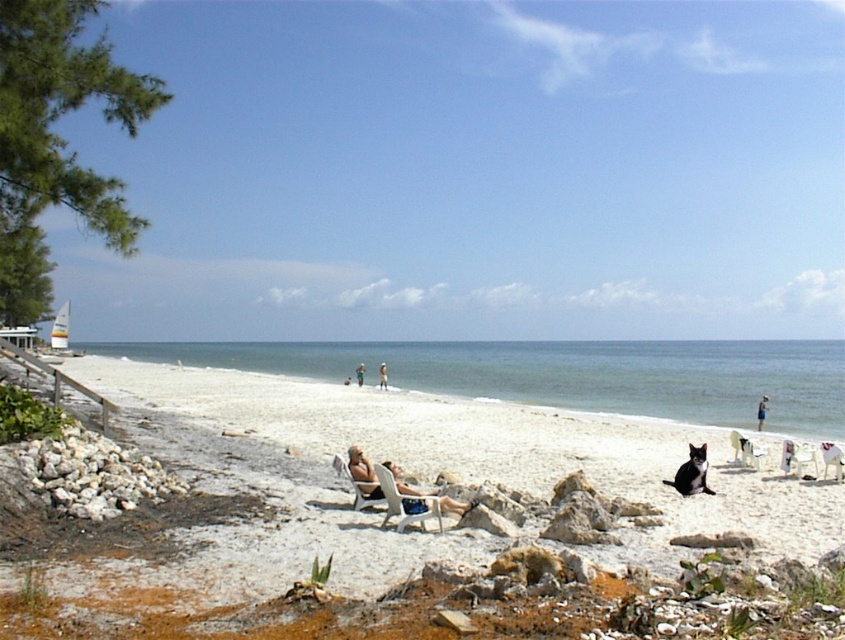
You are a photographer planning to capture a sunset shot from the beach. You have two chairs available for your equipment setup. The white plastic beach chair at center and the matte black lounge chair at center. Which chair should you place your equipment on if you want it to be closer to the left side of the frame?

The white plastic beach chair at center is positioned on the left side of the matte black lounge chair at center, so placing the equipment on the white plastic beach chair at center will position it closer to the left side of the frame.

You are a photographer trying to capture a photo of the white sand beach at lower center and the blue fabric person at lower center. Which object in the scene is positioned higher from the ground level?

The white sand beach at lower center is much taller than the blue fabric person at lower center, so it is positioned higher from the ground level.